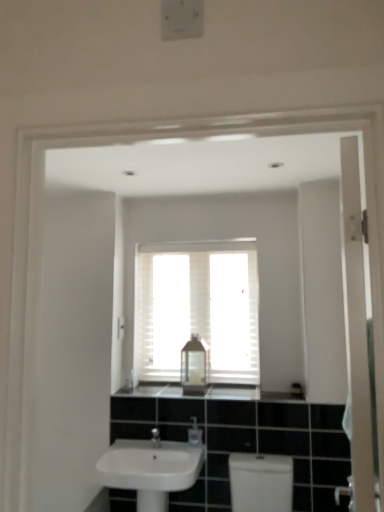
What are the coordinates of `free location above black granite countertop at center (from a real-world perspective)` in the screenshot? It's located at (223, 387).